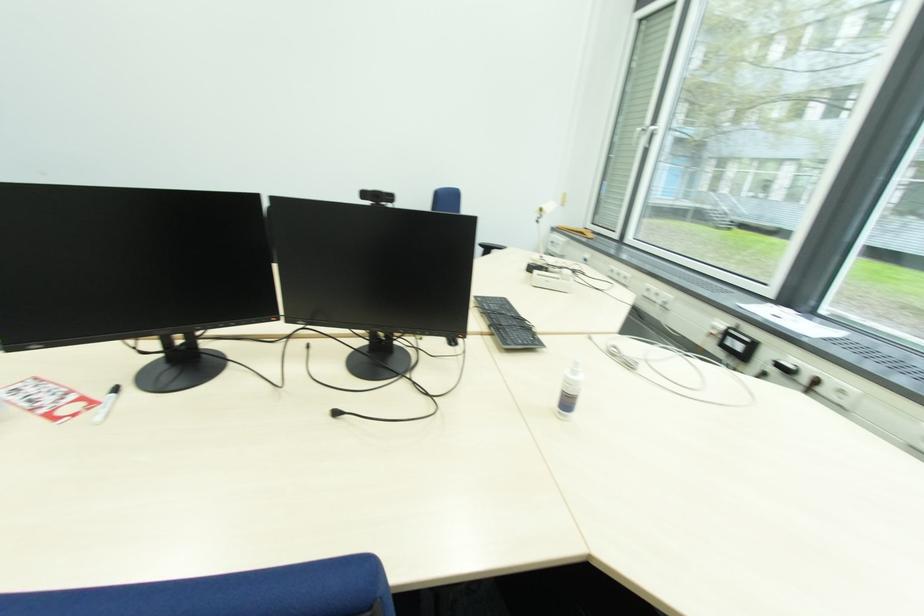
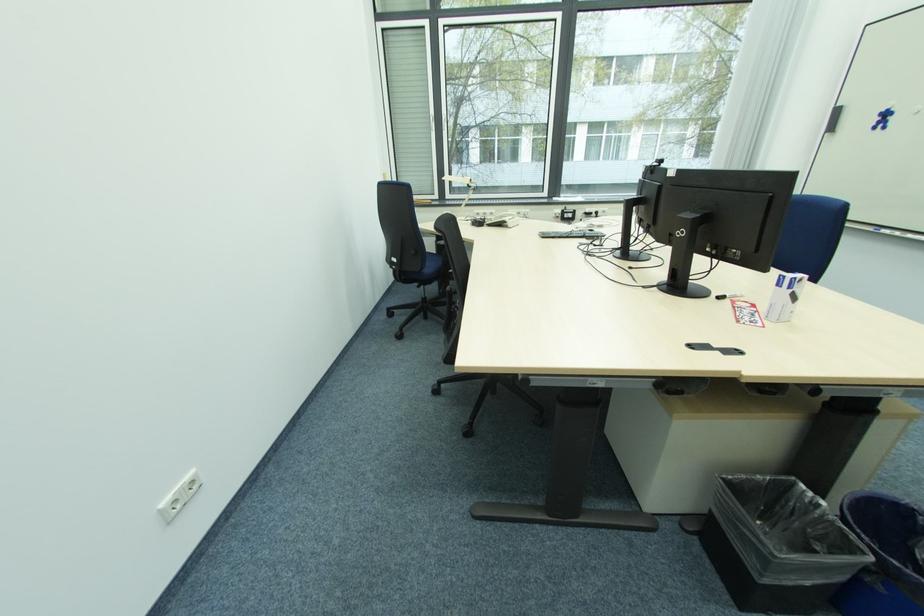
In the second image, find the point that corresponds to pixel 629 280 in the first image.

(494, 216)